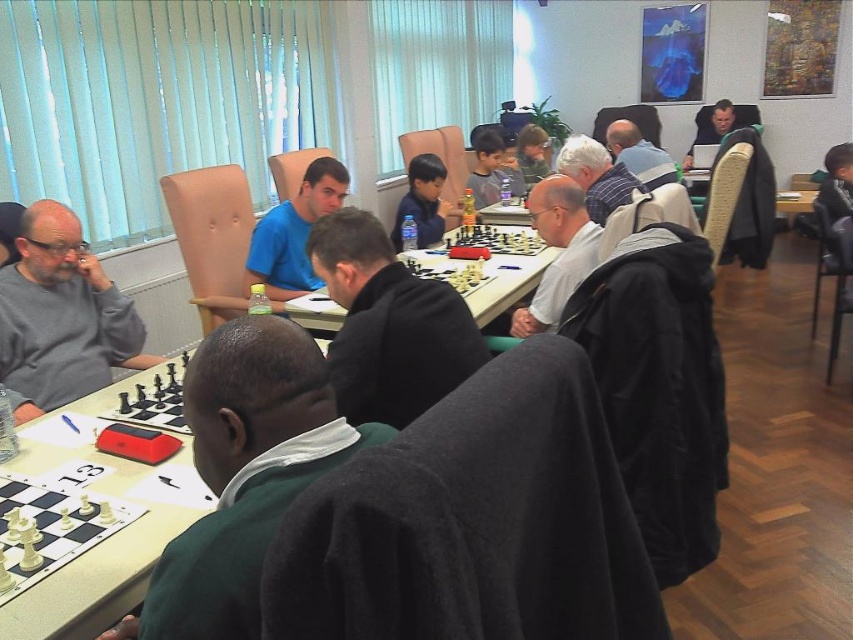
Consider the image. You are a photographer standing in the back of the room. You want to take a photo of both the matte black jacket at upper center and the matte black shirt at center. Which object will appear larger in the photo?

The matte black jacket at upper center will appear larger in the photo because it has a larger size compared to the matte black shirt at center.

You are a photographer standing at the back of the room. You want to take a photo that includes both the white matte jacket at center and the wooden chessboard at center. Which object will appear larger in your photo?

The white matte jacket at center will appear larger in the photo because it is closer to the viewer than the wooden chessboard at center.

You are standing at the origin point in the image. Where is the matte black jacket at upper center located in terms of coordinates?

The matte black jacket at upper center is located at coordinates point [637,152].